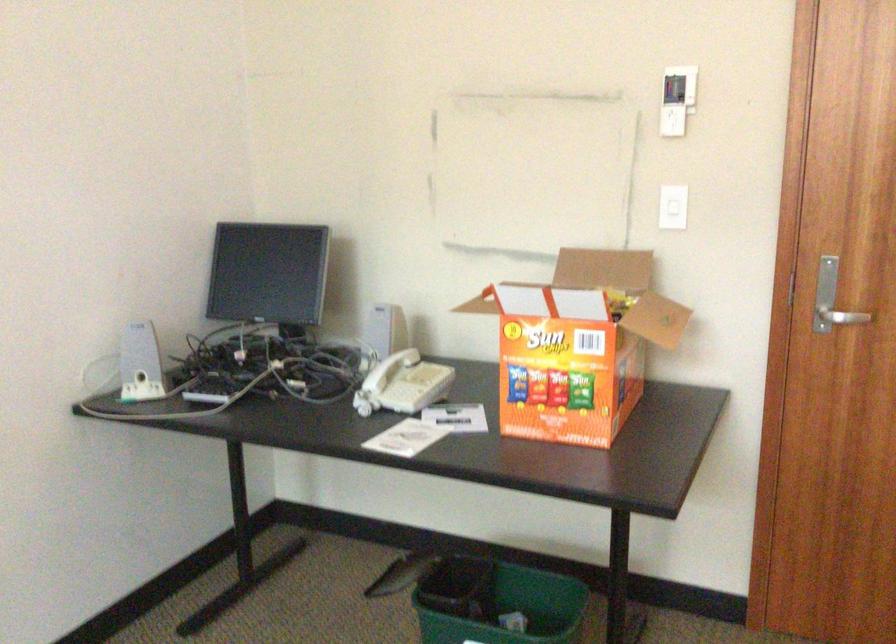
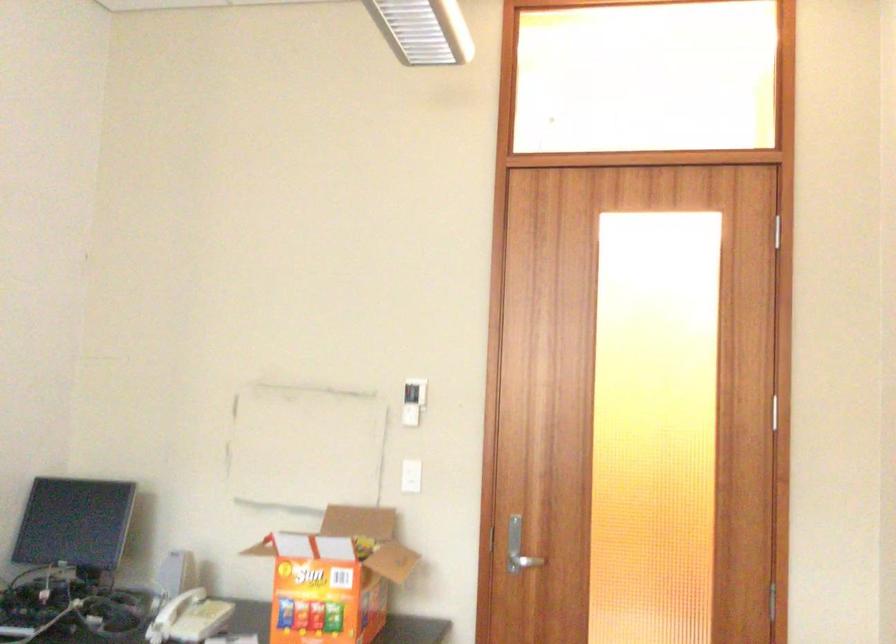
Question: The images are taken continuously from a first-person perspective. In which direction are you moving?

Choices:
 (A) Left
 (B) Right
 (C) Forward
 (D) Backward

Answer: (D)